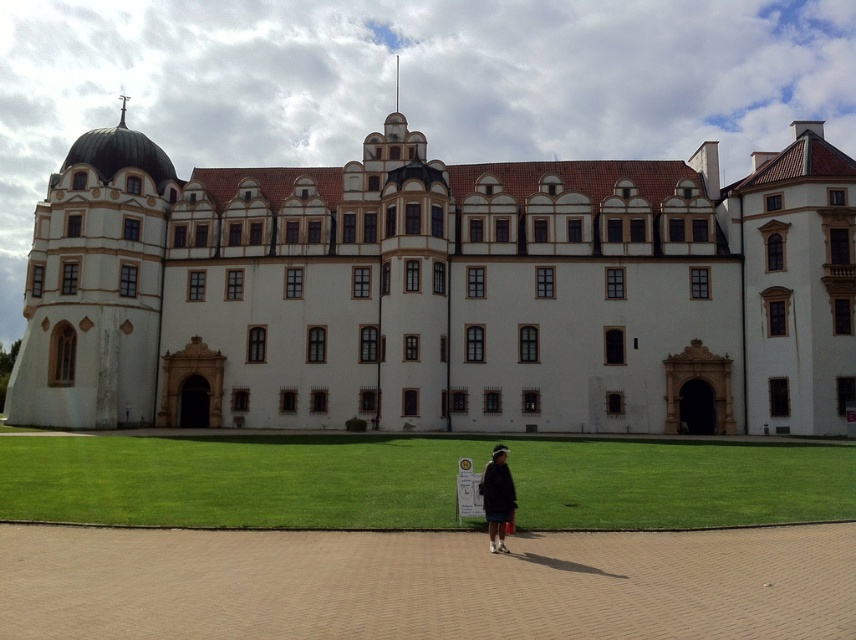
Question: Among these objects, which one is farthest from the camera?

Choices:
 (A) green grass at lower center
 (B) white stone building at center
 (C) dark gray sweater at center

Answer: (B)

Question: Which of the following is the closest to the observer?

Choices:
 (A) (816, 481)
 (B) (450, 300)

Answer: (A)

Question: Which point appears closest to the camera in this image?

Choices:
 (A) (431, 444)
 (B) (483, 500)
 (C) (417, 145)

Answer: (B)

Question: Does white stone building at center have a greater width compared to green grass at lower center?

Choices:
 (A) no
 (B) yes

Answer: (B)

Question: Does white stone building at center appear under green grass at lower center?

Choices:
 (A) yes
 (B) no

Answer: (B)

Question: Does white stone building at center come in front of green grass at lower center?

Choices:
 (A) yes
 (B) no

Answer: (B)